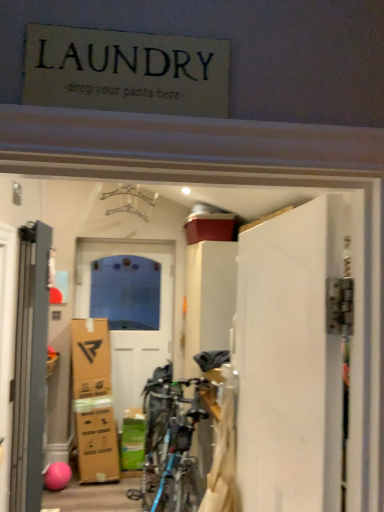
Question: Is gray matte door at left, which is counted as the second door, starting from the right, in front of or behind white glossy door at center, placed as the first door when sorted from left to right, in the image?

Choices:
 (A) front
 (B) behind

Answer: (A)

Question: In terms of width, does gray matte door at left, arranged as the second door when viewed from the back, look wider or thinner when compared to white glossy door at center, acting as the 3th door starting from the front?

Choices:
 (A) thin
 (B) wide

Answer: (B)

Question: Which object is the farthest from the white matte door at right, marked as the third door in a back-to-front arrangement?

Choices:
 (A) white glossy door at center, placed as the first door when sorted from left to right
 (B) gray matte door at left, arranged as the second door when viewed from the back

Answer: (A)

Question: Estimate the real-world distances between objects in this image. Which object is closer to the gray matte door at left, arranged as the second door when viewed from the back?

Choices:
 (A) white matte door at right, which ranks as the 3th door in left-to-right order
 (B) white glossy door at center, acting as the 1th door starting from the back

Answer: (A)